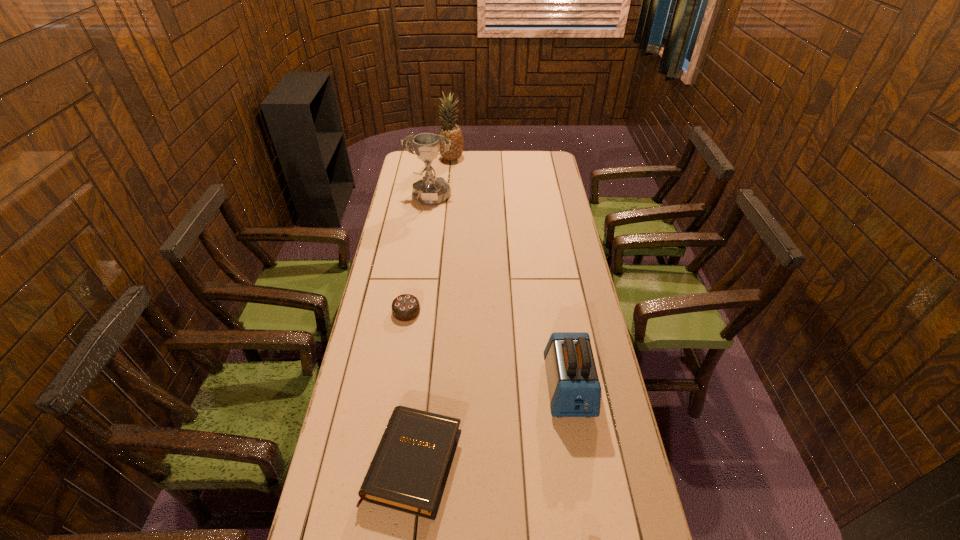
You are a GUI agent. You are given a task and a screenshot of the screen. Output one action in this format:
    pyautogui.click(x=<x>, y=<y>)
    Task: Click on the free space that is in between the rightmost object and the fourth nearest object
    
    Given the screenshot: What is the action you would take?
    pyautogui.click(x=499, y=294)

Locate an element on the screen. This screenshot has height=540, width=960. free space between the fourth nearest object and the shortest object is located at coordinates (422, 332).

This screenshot has height=540, width=960. I want to click on vacant area that lies between the farthest object and the chocolate cake, so click(x=429, y=235).

Where is `vacant area that lies between the Bible and the third farthest object`? The image size is (960, 540). vacant area that lies between the Bible and the third farthest object is located at coordinates (410, 387).

The height and width of the screenshot is (540, 960). In order to click on free space between the pineapple and the third shortest object in this screenshot , I will do `click(510, 273)`.

At what (x,y) coordinates should I click in order to perform the action: click on vacant space that is in between the shortest object and the pineapple. Please return your answer as a coordinate pair (x, y). The image size is (960, 540). Looking at the image, I should click on (433, 311).

Find the location of a particular element. unoccupied position between the award and the rightmost object is located at coordinates (499, 294).

Find the location of a particular element. object that is the third closest to the Bible is located at coordinates (429, 191).

Image resolution: width=960 pixels, height=540 pixels. In order to click on object that can be found as the fourth closest to the farthest object in this screenshot , I will do `click(409, 471)`.

Image resolution: width=960 pixels, height=540 pixels. Identify the location of vacant space that satisfies the following two spatial constraints: 1. on the side with emblem of the Bible; 2. on the left side of the second farthest object. (394, 463).